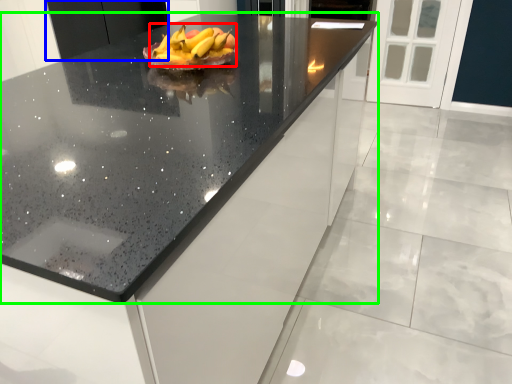
Question: Estimate the real-world distances between objects in this image. Which object is closer to grapefruit (highlighted by a red box), cabinetry (highlighted by a blue box) or countertop (highlighted by a green box)?

Choices:
 (A) cabinetry
 (B) countertop

Answer: (B)